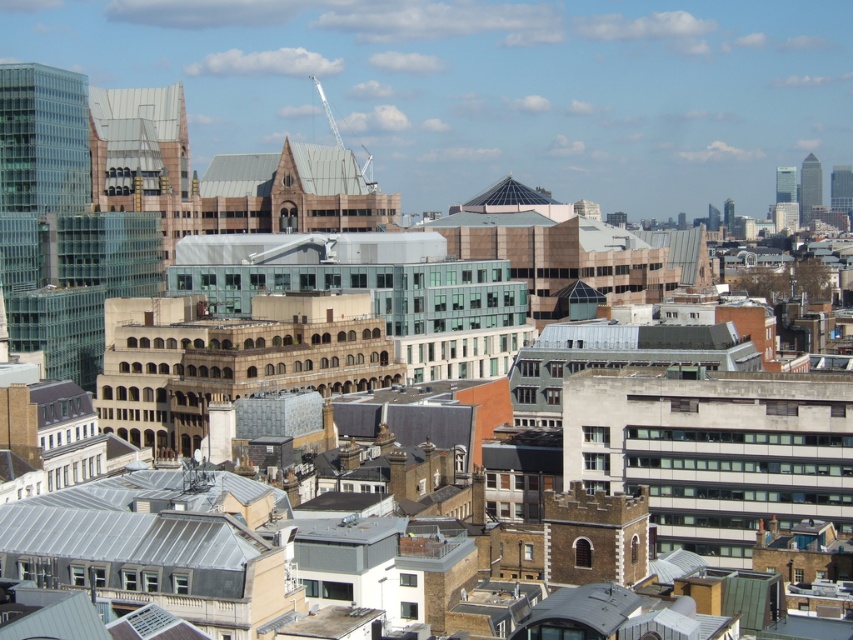
Question: Can you confirm if glassy silver skyscraper at upper right is bigger than glassy steel skyscraper at right?

Choices:
 (A) no
 (B) yes

Answer: (A)

Question: Which point is closer to the camera?

Choices:
 (A) glassy skyscraper at upper right
 (B) glassy steel skyscraper at right
 (C) glassy silver skyscraper at upper right

Answer: (B)

Question: Is glassy silver skyscraper at upper right wider than glassy steel skyscraper at right?

Choices:
 (A) yes
 (B) no

Answer: (A)

Question: Which is farther from the glassy silver skyscraper at upper right?

Choices:
 (A) glassy skyscraper at upper right
 (B) glassy steel skyscraper at right

Answer: (B)

Question: Which object is farther from the camera taking this photo?

Choices:
 (A) glassy silver skyscraper at upper right
 (B) glassy steel skyscraper at right

Answer: (A)

Question: Is glassy silver skyscraper at upper right closer to the viewer compared to glassy steel skyscraper at right?

Choices:
 (A) no
 (B) yes

Answer: (A)